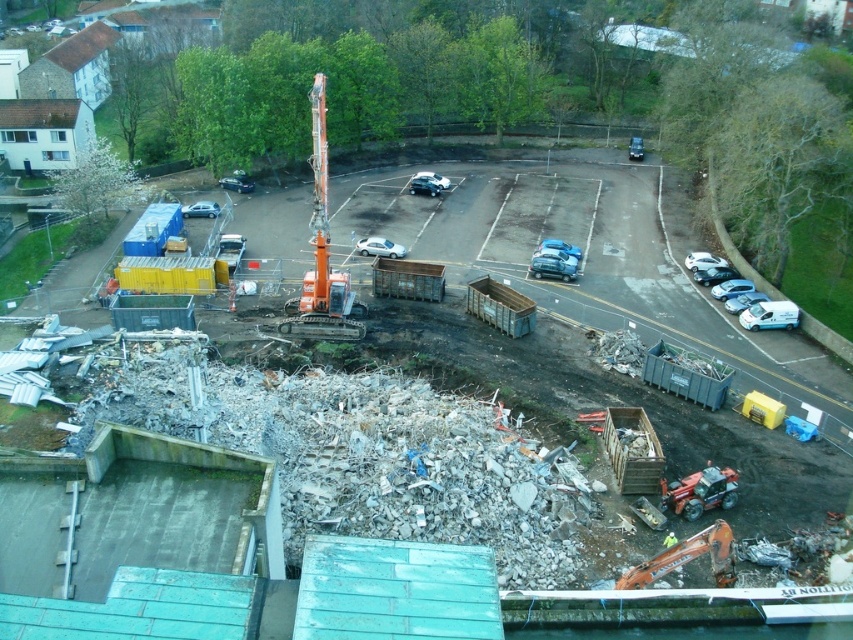
Consider the image. You are a delivery person needing to park your van, which is 6 meters long, in the construction site. The white matte car at center and the silver metallic car at center are blocking the only available parking spot. Which car should you move first to free up enough space for your van?

The white matte car at center has a larger size compared to silver metallic car at center. Therefore, you should move the white matte car at center first to free up more space for your van.

You are a delivery person trying to park your 2.5 meter tall truck in the construction site. You see the white matte car at center and the silver metallic car at center. Which car is taller and would block your truck from passing through?

The white matte car at center is taller than the silver metallic car at center, so it would block your truck from passing through if it is parked in the way.